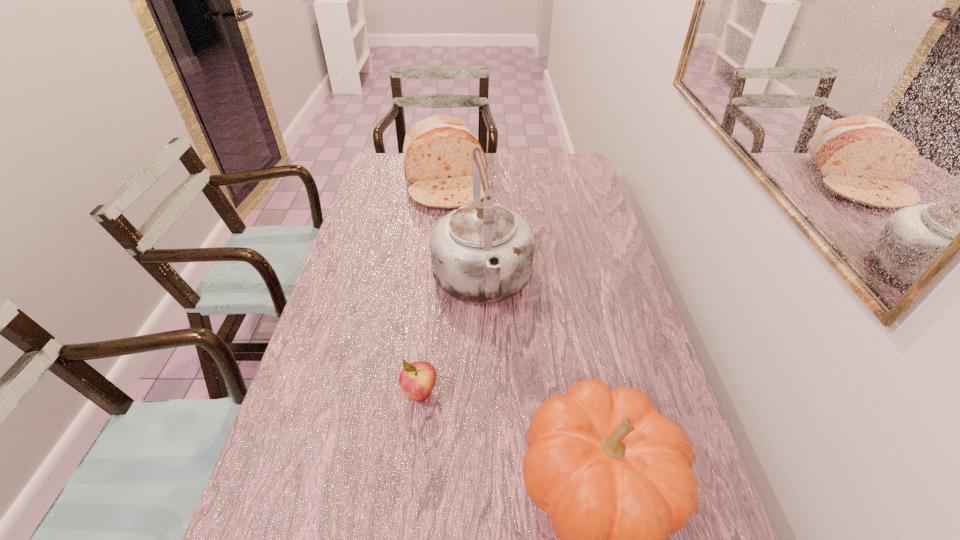
Locate an element on the screen. This screenshot has width=960, height=540. free spot on the desktop that is between the shortest object and the pumpkin and is positioned at the sliced end of the bread is located at coordinates (526, 448).

Image resolution: width=960 pixels, height=540 pixels. I want to click on free spot on the desktop that is between the shortest object and the pumpkin and is positioned at the spout of the tallest object, so click(x=514, y=442).